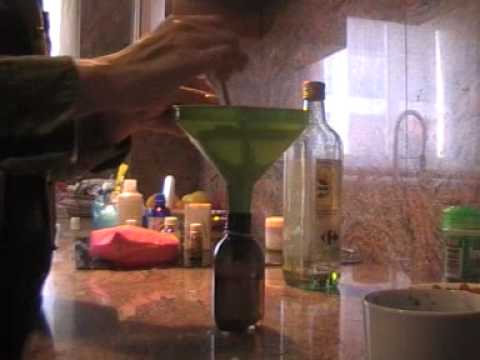
This screenshot has width=480, height=360. I want to click on wall, so click(x=374, y=75).